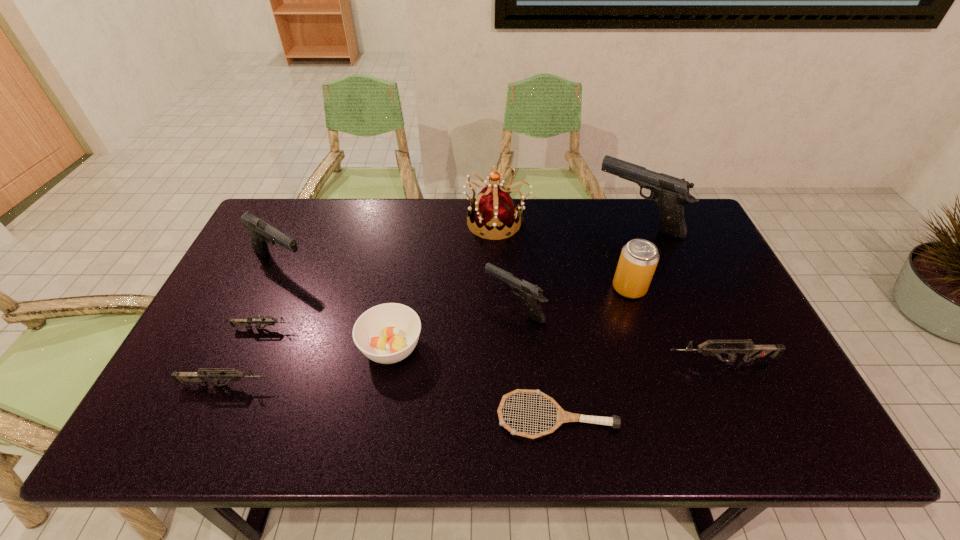
Locate an element on the screen. vacant space located 0.110m at the muzzle of the rightmost black gun is located at coordinates (564, 221).

I want to click on vacant position located at the muzzle of the rightmost black gun, so pyautogui.click(x=496, y=221).

The width and height of the screenshot is (960, 540). I want to click on free spot located 0.290m at the muzzle of the rightmost black gun, so click(x=512, y=221).

Where is `free space located at the muzzle of the second tallest gun`? The image size is (960, 540). free space located at the muzzle of the second tallest gun is located at coordinates (388, 264).

Locate an element on the screen. The height and width of the screenshot is (540, 960). vacant area situated on the left of the pop (soda) is located at coordinates (557, 288).

What are the coordinates of `free space located 0.290m at the muzzle of the second black gun from right to left` in the screenshot? It's located at (380, 308).

Identify the location of vacant position located 0.100m at the muzzle of the second black gun from right to left. The height and width of the screenshot is (540, 960). (449, 308).

Locate an element on the screen. The image size is (960, 540). free spot located 0.340m at the muzzle of the second black gun from right to left is located at coordinates (362, 308).

Find the location of a particular element. vacant point located 0.290m aimed along the barrel of the biggest grey gun is located at coordinates (549, 361).

Image resolution: width=960 pixels, height=540 pixels. What are the coordinates of `vacant area situated 0.180m aimed along the barrel of the biggest grey gun` in the screenshot? It's located at (593, 361).